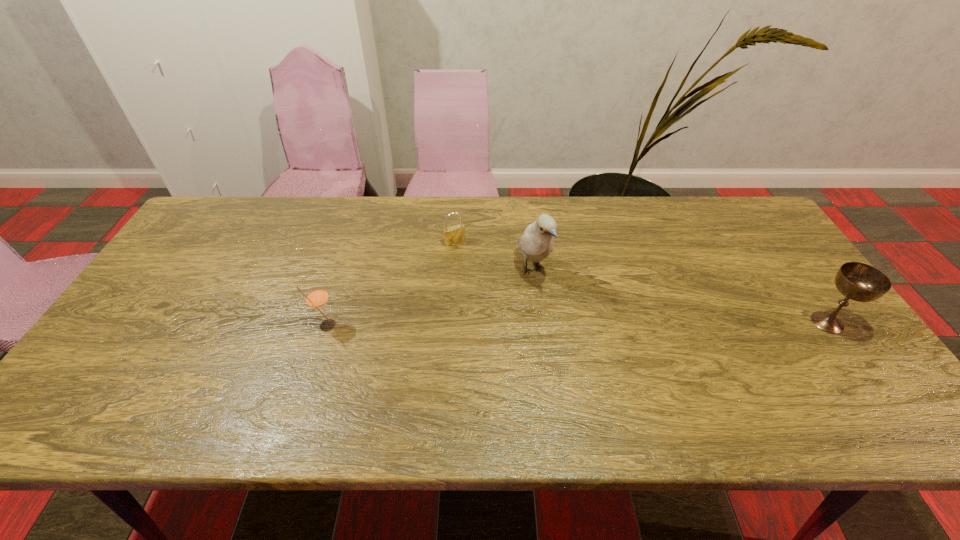
Where is `vacant region between the leftmost object and the farthest object`? vacant region between the leftmost object and the farthest object is located at coordinates (391, 284).

At what (x,y) coordinates should I click in order to perform the action: click on free point between the bird and the chalice. Please return your answer as a coordinate pair (x, y). Image resolution: width=960 pixels, height=540 pixels. Looking at the image, I should click on coord(680,296).

What are the coordinates of `free space that is in between the rightmost object and the farthest object` in the screenshot? It's located at (641, 282).

At what (x,y) coordinates should I click in order to perform the action: click on the third closest object relative to the bird. Please return your answer as a coordinate pair (x, y). The height and width of the screenshot is (540, 960). Looking at the image, I should click on (860, 282).

What are the coordinates of `object that is the closest to the shortest object` in the screenshot? It's located at (537, 242).

Find the location of `blank space that satisfies the following two spatial constraints: 1. on the back side of the rightmost object; 2. on the left side of the straw`. blank space that satisfies the following two spatial constraints: 1. on the back side of the rightmost object; 2. on the left side of the straw is located at coordinates (328, 322).